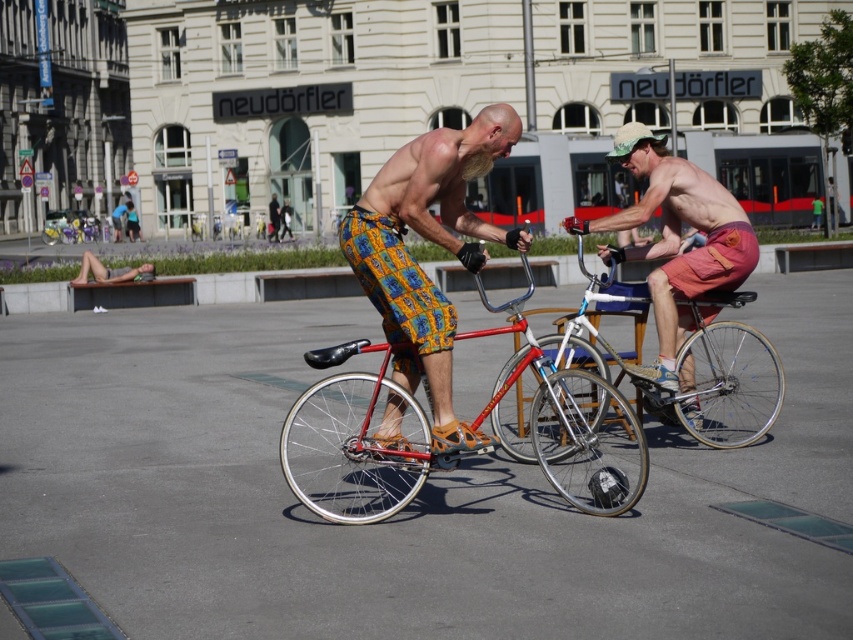
You are a city planner analyzing the plaza layout. The shiny metallic bicycle at center and the shiny silver bicycle at center are parked side by side. Which bicycle occupies more horizontal space in the image?

The shiny metallic bicycle at center is wider than the shiny silver bicycle at center, so it occupies more horizontal space in the image.

Based on the photo, you are standing in the public square and want to determine the relative positions of two points marked in the scene. Which point, point 1 at coordinates (334, 492) or point 2 at coordinates (701, 323), is closer to you?

Point 1 at coordinates (334, 492) is closer to the viewer than point 2 at coordinates (701, 323).

You are standing in the public square and want to locate the shiny metallic bicycle at center. According to the coordinates provided, where should you look?

You should look at point [352,442] to find the shiny metallic bicycle at center.